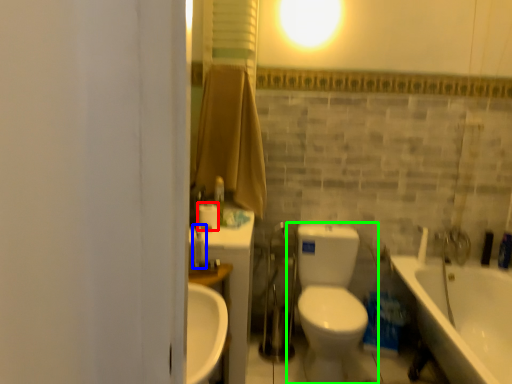
Question: Based on their relative distances, which object is farther from toilet paper (highlighted by a red box)? Choose from fixture (highlighted by a blue box) and toilet (highlighted by a green box).

Choices:
 (A) fixture
 (B) toilet

Answer: (B)